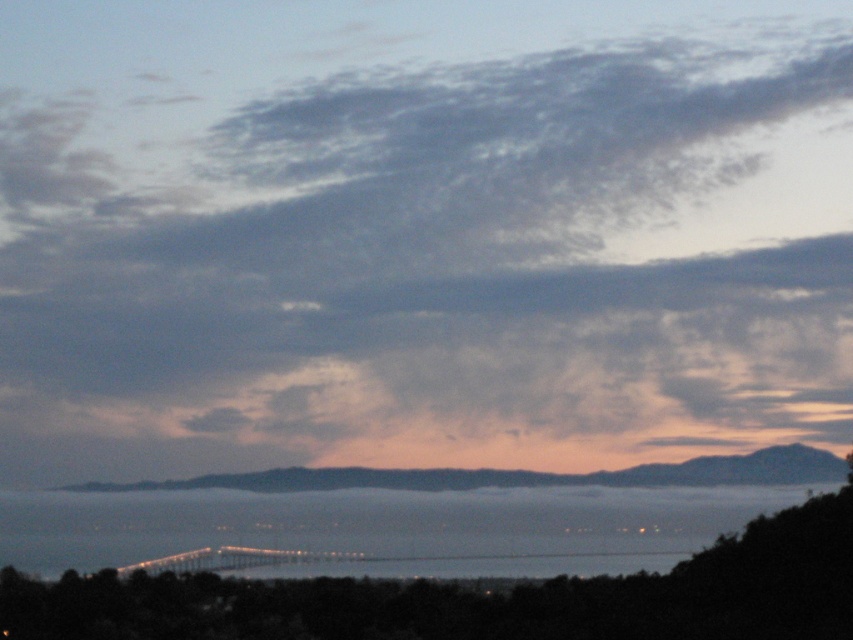
You are a photographer wanting to capture the blue water at center and metallic gray bridge at center in your shot. Based on their positions, which object would appear closer to the top of the photo?

The blue water at center is located above the metallic gray bridge at center, so it would appear closer to the top of the photo.